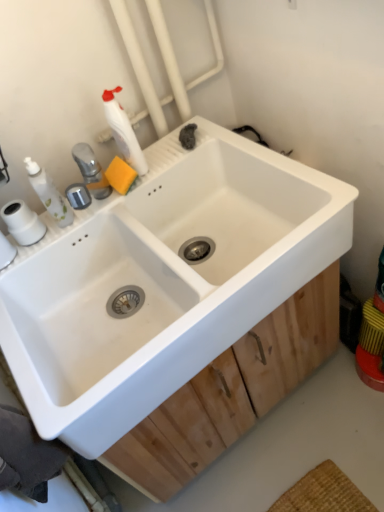
Measure the distance between white ceramic sink at center and camera.

The distance of white ceramic sink at center from camera is 30.87 inches.

What do you see at coordinates (22, 222) in the screenshot? I see `white matte toilet paper at left` at bounding box center [22, 222].

What do you see at coordinates (49, 193) in the screenshot? This screenshot has width=384, height=512. I see `white plastic soap dispenser at upper left` at bounding box center [49, 193].

Image resolution: width=384 pixels, height=512 pixels. What are the coordinates of `white ceramic sink at center` in the screenshot? It's located at (163, 281).

Based on the photo, does white matte bottle at upper left contain white ceramic sink at center?

Actually, white ceramic sink at center is outside white matte bottle at upper left.

From their relative heights in the image, would you say white matte bottle at upper left is taller or shorter than white ceramic sink at center?

Considering their sizes, white matte bottle at upper left has less height than white ceramic sink at center.

Between white matte bottle at upper left and white ceramic sink at center, which one appears on the right side from the viewer's perspective?

→ white ceramic sink at center.

Consider the image. Does white matte bottle at upper left have a lesser width compared to white ceramic sink at center?

Indeed, white matte bottle at upper left has a lesser width compared to white ceramic sink at center.

Is white plastic soap dispenser at upper left thinner than wooden at center?

Indeed, white plastic soap dispenser at upper left has a lesser width compared to wooden at center.

Which of these two, white plastic soap dispenser at upper left or wooden at center, is smaller?

white plastic soap dispenser at upper left.

Is point (43, 188) closer to camera compared to point (291, 372)?

Yes, point (43, 188) is closer to viewer.

Consider the image. Would you say white plastic soap dispenser at upper left is outside wooden at center?

Yes, white plastic soap dispenser at upper left is located beyond the bounds of wooden at center.

In the scene shown: Is wooden at center closer to the viewer compared to white plastic soap dispenser at upper left?

No, it is not.

Do you think wooden at center is within white plastic soap dispenser at upper left, or outside of it?

wooden at center is spatially situated outside white plastic soap dispenser at upper left.

Between wooden at center and white plastic soap dispenser at upper left, which one has less height?

wooden at center.

From the image's perspective, is wooden at center below white plastic soap dispenser at upper left?

Yes, from the image's perspective, wooden at center is beneath white plastic soap dispenser at upper left.

Does white matte toilet paper at left come behind white ceramic sink at center?

Yes, white matte toilet paper at left is behind white ceramic sink at center.

Can we say white matte toilet paper at left lies outside white ceramic sink at center?

Yes, white matte toilet paper at left is not within white ceramic sink at center.

Which is in front, point (15, 238) or point (98, 430)?

The point (98, 430) is in front.

From a real-world perspective, is white matte toilet paper at left located higher than white ceramic sink at center?

Yes, from a real-world perspective, white matte toilet paper at left is on top of white ceramic sink at center.

Considering the relative sizes of white ceramic sink at center and wooden at center in the image provided, is white ceramic sink at center smaller than wooden at center?

Incorrect, white ceramic sink at center is not smaller in size than wooden at center.

What's the angular difference between white ceramic sink at center and wooden at center's facing directions?

They differ by 0.743 degrees in their facing directions.

From the picture: Considering the relative sizes of white ceramic sink at center and wooden at center in the image provided, is white ceramic sink at center taller than wooden at center?

Indeed, white ceramic sink at center has a greater height compared to wooden at center.

Looking at this image, does white ceramic sink at center have a greater width compared to wooden at center?

In fact, white ceramic sink at center might be narrower than wooden at center.

Is white plastic soap dispenser at upper left not close to white matte toilet paper at left?

No, white plastic soap dispenser at upper left is not far away from white matte toilet paper at left.

Is white plastic soap dispenser at upper left shorter than white matte toilet paper at left?

Incorrect, the height of white plastic soap dispenser at upper left does not fall short of that of white matte toilet paper at left.

Can we say white plastic soap dispenser at upper left lies outside white matte toilet paper at left?

white plastic soap dispenser at upper left is positioned outside white matte toilet paper at left.

Considering the positions of objects white ceramic sink at center and white matte bottle at upper left in the image provided, who is more to the left, white ceramic sink at center or white matte bottle at upper left?

white matte bottle at upper left.

Considering the sizes of white ceramic sink at center and white matte bottle at upper left in the image, is white ceramic sink at center taller or shorter than white matte bottle at upper left?

In the image, white ceramic sink at center appears to be taller than white matte bottle at upper left.

From the image's perspective, which one is positioned higher, white ceramic sink at center or white matte bottle at upper left?

From the image's view, white matte bottle at upper left is above.

Can you tell me how much white ceramic sink at center and white matte bottle at upper left differ in facing direction?

There is a 0.205-degree angle between the facing directions of white ceramic sink at center and white matte bottle at upper left.

Identify the location of cleaning product above the white ceramic sink at center (from a real-world perspective). Image resolution: width=384 pixels, height=512 pixels. (123, 132).

Find the location of `drawer on the right side of white plastic soap dispenser at upper left`. drawer on the right side of white plastic soap dispenser at upper left is located at coordinates (231, 392).

When comparing their distances from white plastic soap dispenser at upper left, does white matte bottle at upper left or white matte toilet paper at left seem closer?

white matte toilet paper at left lies closer to white plastic soap dispenser at upper left than the other object.

Based on the photo, based on their spatial positions, is white matte bottle at upper left or white ceramic sink at center closer to white matte toilet paper at left?

white matte bottle at upper left lies closer to white matte toilet paper at left than the other object.

Which object lies further to the anchor point white ceramic sink at center, white matte toilet paper at left or white matte bottle at upper left?

white matte toilet paper at left lies further to white ceramic sink at center than the other object.

Looking at the image, which one is located further to white ceramic sink at center, wooden at center or white matte bottle at upper left?

Among the two, white matte bottle at upper left is located further to white ceramic sink at center.

Estimate the real-world distances between objects in this image. Which object is closer to white ceramic sink at center, white matte toilet paper at left or wooden at center?

wooden at center is positioned closer to the anchor white ceramic sink at center.

Consider the image. Estimate the real-world distances between objects in this image. Which object is closer to white matte toilet paper at left, white matte bottle at upper left or wooden at center?

white matte bottle at upper left is closer to white matte toilet paper at left.

Considering their positions, is white ceramic sink at center positioned closer to white plastic soap dispenser at upper left than white matte bottle at upper left?

The object closer to white plastic soap dispenser at upper left is white matte bottle at upper left.

From the image, which object appears to be nearer to white ceramic sink at center, white matte toilet paper at left or white plastic soap dispenser at upper left?

white plastic soap dispenser at upper left is positioned closer to the anchor white ceramic sink at center.

In order to click on sink that lies between white matte bottle at upper left and wooden at center from top to bottom in this screenshot , I will do `click(163, 281)`.

I want to click on toilet paper between white matte bottle at upper left and wooden at center vertically, so click(22, 222).

Locate an element on the screen. The height and width of the screenshot is (512, 384). cleaning product between white matte toilet paper at left and white ceramic sink at center is located at coordinates (123, 132).

This screenshot has width=384, height=512. What are the coordinates of `sink between white matte toilet paper at left and wooden at center vertically` in the screenshot? It's located at (163, 281).